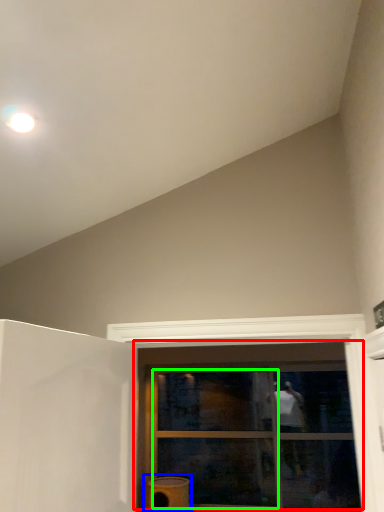
Question: Considering the real-world distances, which object is farthest from window (highlighted by a red box)? water heater (highlighted by a blue box) or glass door (highlighted by a green box)?

Choices:
 (A) water heater
 (B) glass door

Answer: (A)